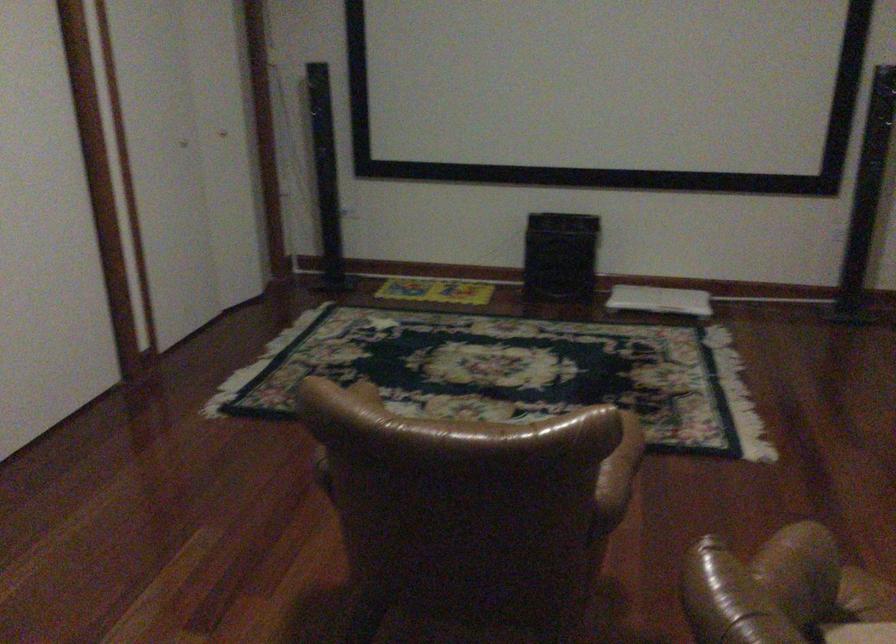
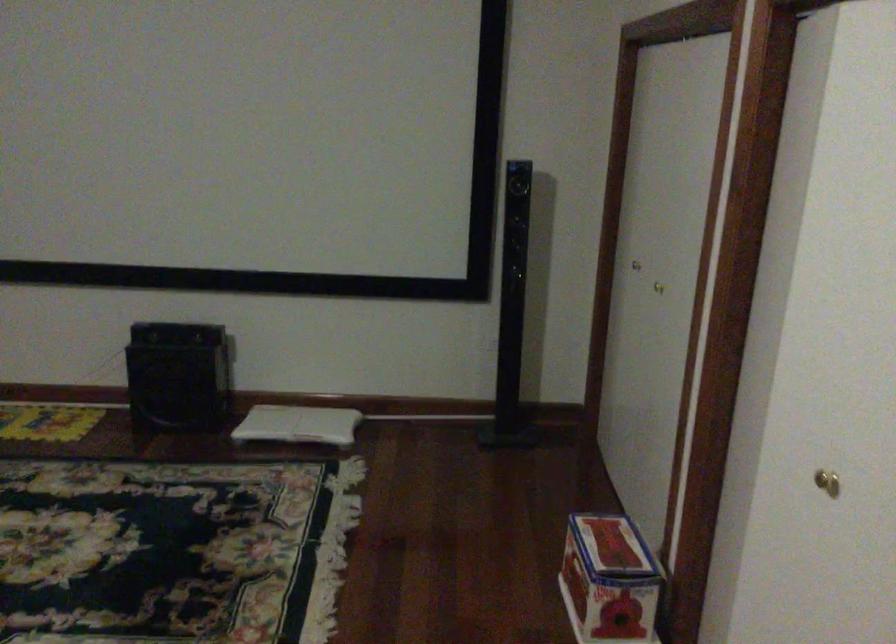
Question: The images are taken continuously from a first-person perspective. In which direction is your viewpoint rotating?

Choices:
 (A) Left
 (B) Right
 (C) Up
 (D) Down

Answer: (B)